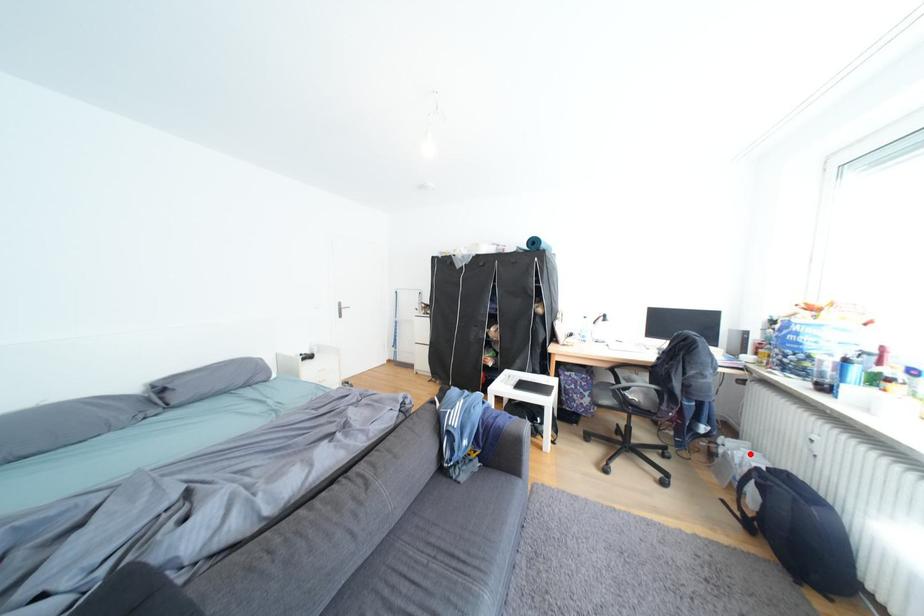
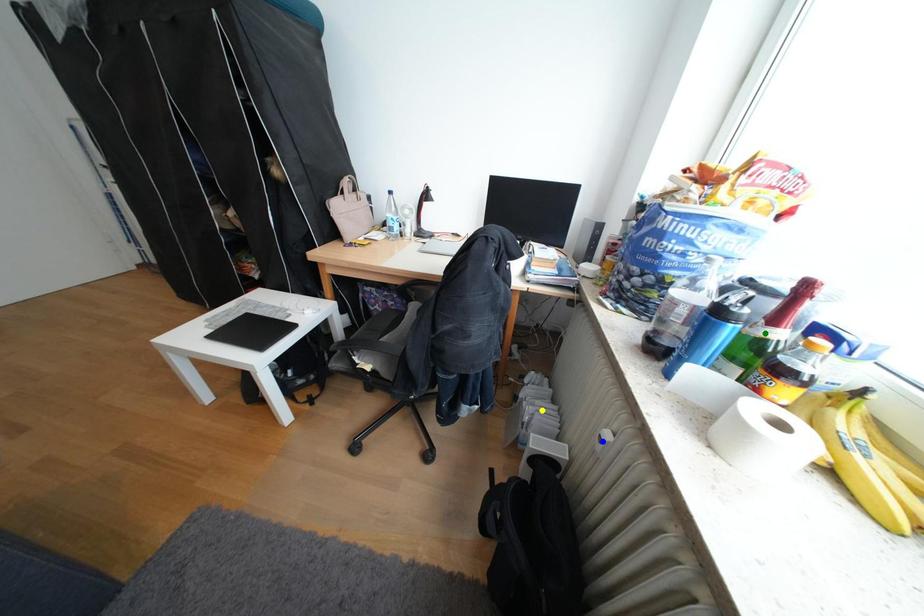
Question: I am providing you with two images of the same scene from different viewpoints. A red point is marked on the first image. You are given multiple points on the second image. Which point in image 2 is actually the same real-world point as the red point in image 1?

Choices:
 (A) blue point
 (B) green point
 (C) yellow point

Answer: (C)